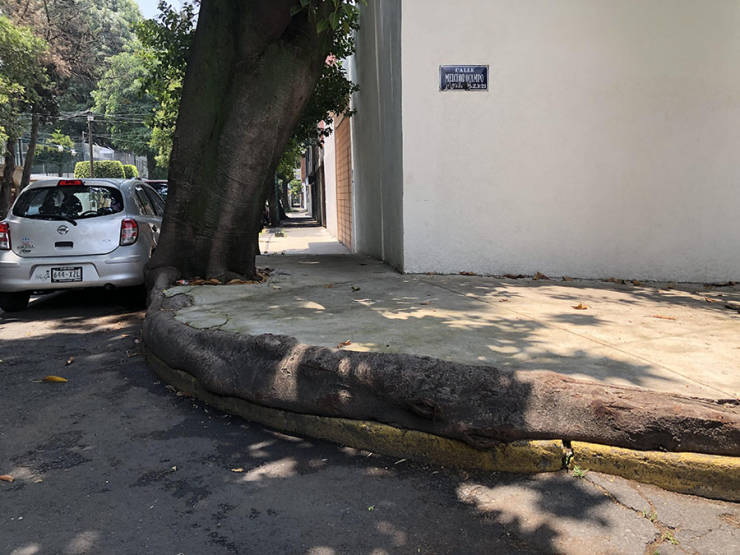
Locate an element on the screen. brick wall is located at coordinates (342, 181).